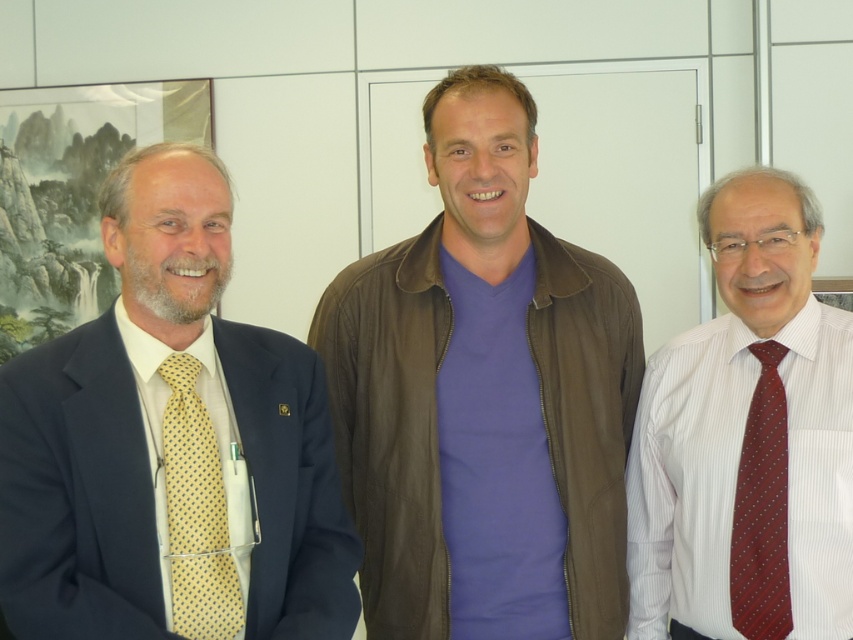
Can you confirm if white striped shirt with red tie at right is positioned to the left of yellow dotted tie at left?

Incorrect, white striped shirt with red tie at right is not on the left side of yellow dotted tie at left.

Does point (633, 584) lie behind point (170, 419)?

Yes.

The width and height of the screenshot is (853, 640). What are the coordinates of `white striped shirt with red tie at right` in the screenshot? It's located at (747, 438).

Who is positioned more to the left, white striped shirt with red tie at right or maroon silk tie at right?

white striped shirt with red tie at right

What do you see at coordinates (747, 438) in the screenshot? I see `white striped shirt with red tie at right` at bounding box center [747, 438].

Between point (758, 580) and point (756, 442), which one is positioned in front?

Positioned in front is point (758, 580).

Image resolution: width=853 pixels, height=640 pixels. I want to click on white striped shirt with red tie at right, so click(747, 438).

Is yellow dotted tie at left behind maroon silk tie at right?

No, yellow dotted tie at left is in front of maroon silk tie at right.

Is yellow dotted tie at left shorter than maroon silk tie at right?

Yes.

Does point (202, 486) lie in front of point (763, 385)?

Yes, it is.

Where is `yellow dotted tie at left`? yellow dotted tie at left is located at coordinates (196, 513).